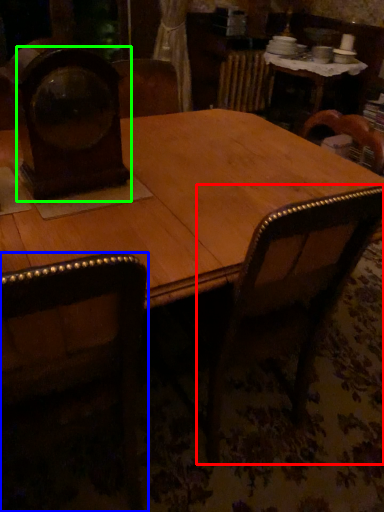
Question: Considering the real-world distances, which object is closest to armchair (highlighted by a red box)? chair (highlighted by a blue box) or clock (highlighted by a green box).

Choices:
 (A) chair
 (B) clock

Answer: (A)